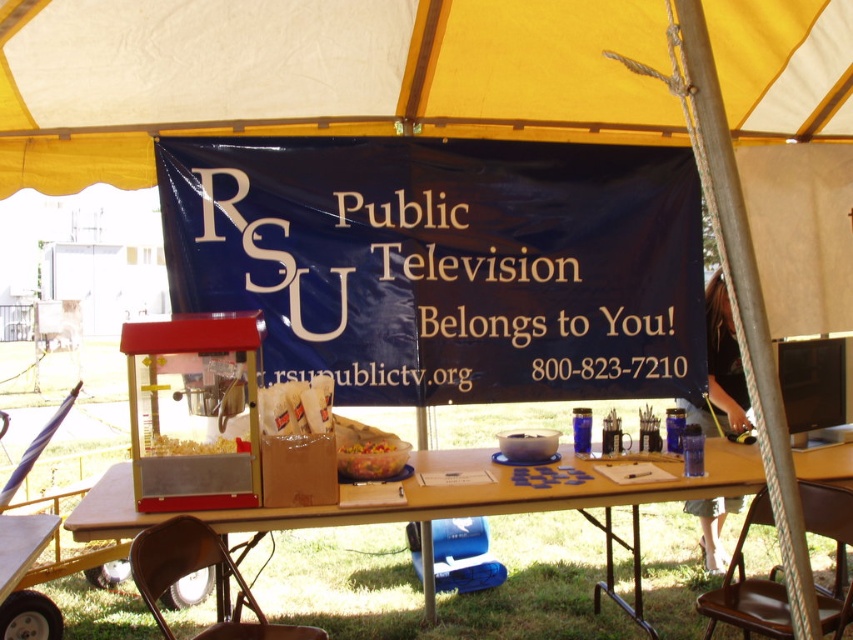
Is yellow fabric canopy at upper center shorter than translucent plastic bowl at center?

No, yellow fabric canopy at upper center is not shorter than translucent plastic bowl at center.

Does yellow fabric canopy at upper center appear on the left side of translucent plastic bowl at center?

In fact, yellow fabric canopy at upper center is to the right of translucent plastic bowl at center.

This screenshot has height=640, width=853. I want to click on yellow fabric canopy at upper center, so click(x=316, y=76).

At what (x,y) coordinates should I click in order to perform the action: click on yellow fabric canopy at upper center. Please return your answer as a coordinate pair (x, y). This screenshot has height=640, width=853. Looking at the image, I should click on (316, 76).

The height and width of the screenshot is (640, 853). What do you see at coordinates (316, 76) in the screenshot? I see `yellow fabric canopy at upper center` at bounding box center [316, 76].

Is point (527, 100) positioned in front of point (167, 454)?

No.

The width and height of the screenshot is (853, 640). Identify the location of yellow fabric canopy at upper center. (316, 76).

Is point (741, 420) positioned in front of point (346, 465)?

No.

Is metallic silver pen at right to the left of translucent plastic bowl at center from the viewer's perspective?

In fact, metallic silver pen at right is to the right of translucent plastic bowl at center.

Measure the distance between point (712, 538) and camera.

Point (712, 538) and camera are 14.08 feet apart.

Locate an element on the screen. metallic silver pen at right is located at coordinates (720, 369).